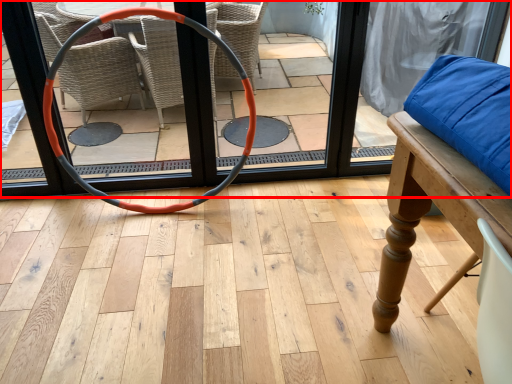
Question: From the image's perspective, considering the relative positions of screen door (annotated by the red box) and hula hoop in the image provided, where is screen door (annotated by the red box) located with respect to the staircase?

Choices:
 (A) below
 (B) above

Answer: (B)